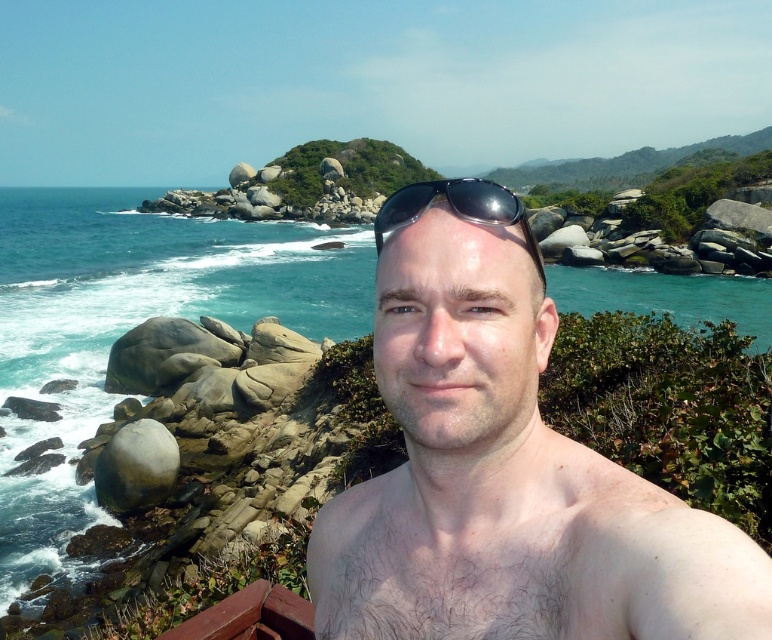
You are a photographer planning to take a picture of the scenic coastal landscape. You want to ensure the smooth skin man at center is centered in the frame. Given that the man is currently at point (503, 467), which direction should you move the camera to center him?

The smooth skin man at center is located at point (503, 467). To center him, move the camera to the left and slightly downward since the current coordinates are to the right and slightly above the center point of the frame.

You are a photographer trying to capture the smooth skin man at center and the black shiny sunglasses at center in a single shot. Based on their positions, can you determine if the sunglasses are resting on the man or hanging on his head?

The smooth skin man at center is below black shiny sunglasses at center, so the sunglasses are likely resting on his head rather than on his face.